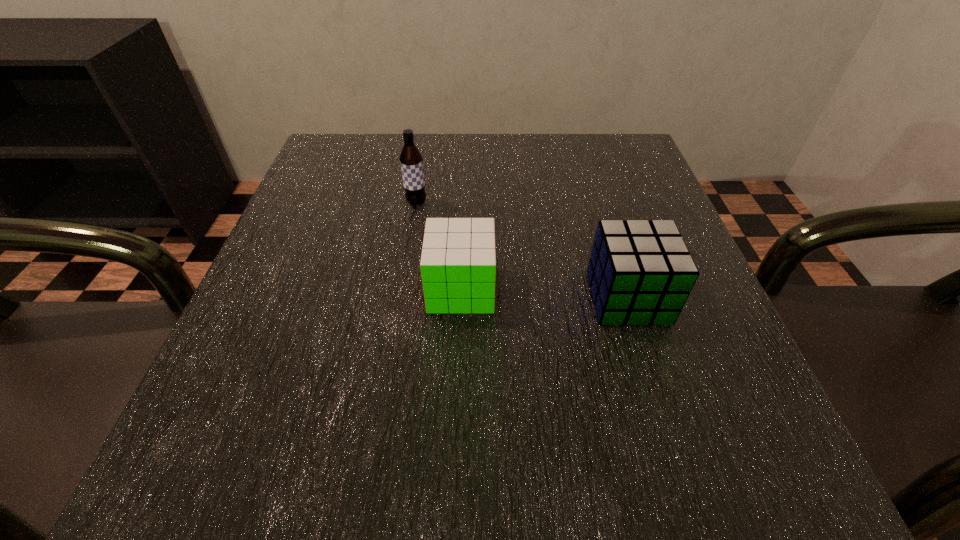
Identify the location of the leftmost object. Image resolution: width=960 pixels, height=540 pixels. point(411,160).

You are a GUI agent. You are given a task and a screenshot of the screen. Output one action in this format:
    pyautogui.click(x=<x>, y=<y>)
    Task: Click on the root beer
    
    Given the screenshot: What is the action you would take?
    pyautogui.click(x=411, y=160)

Find the location of a particular element. The width and height of the screenshot is (960, 540). the right cube is located at coordinates (640, 272).

I want to click on the left cube, so click(458, 262).

At what (x,y) coordinates should I click in order to perform the action: click on vacant space positioned 0.250m on the front of the tallest object. Please return your answer as a coordinate pair (x, y). This screenshot has height=540, width=960. Looking at the image, I should click on (399, 307).

Find the location of `free space located 0.350m on the left of the rightmost object`. free space located 0.350m on the left of the rightmost object is located at coordinates (372, 298).

Locate an element on the screen. free region located on the back of the second object from right to left is located at coordinates (464, 225).

In order to click on object present at the right edge in this screenshot , I will do `click(640, 272)`.

In the image, there is a desktop. Identify the location of vacant space at the far edge. (496, 132).

Where is `vacant area at the near edge of the desktop`? Image resolution: width=960 pixels, height=540 pixels. vacant area at the near edge of the desktop is located at coordinates (527, 434).